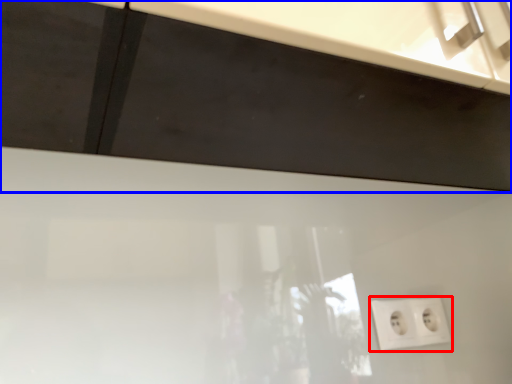
Question: Which of the following is the farthest to the observer, power plugs and sockets (highlighted by a red box) or cabinetry (highlighted by a blue box)?

Choices:
 (A) power plugs and sockets
 (B) cabinetry

Answer: (A)